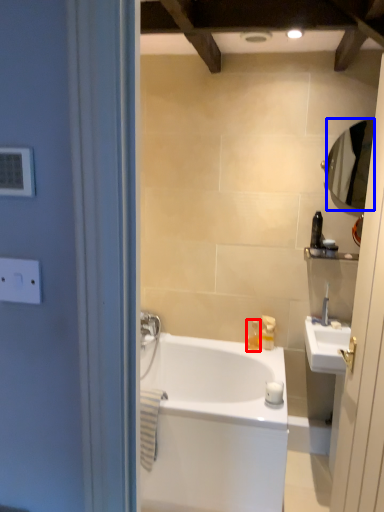
Question: Among these objects, which one is farthest to the camera, toiletry (highlighted by a red box) or mirror (highlighted by a blue box)?

Choices:
 (A) toiletry
 (B) mirror

Answer: (A)